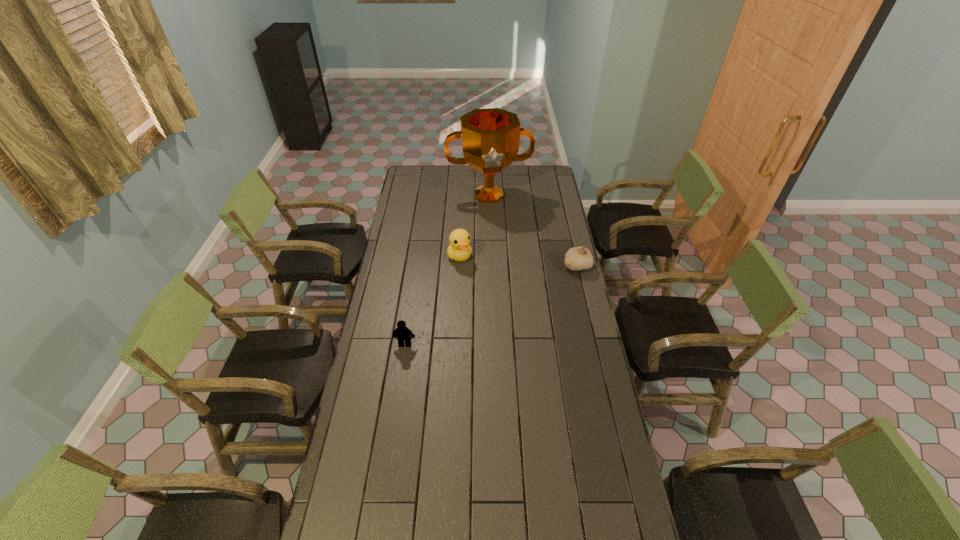
You are a GUI agent. You are given a task and a screenshot of the screen. Output one action in this format:
    pyautogui.click(x=<x>, y=<y>)
    Task: Click on the free spot on the desktop that is between the nearest object and the garlic and is positioned on the side of the farthest object with the star emblem
    
    Given the screenshot: What is the action you would take?
    click(511, 296)

Where is `vacant space on the desktop that is between the nearest object and the garlic and is positioned on the face of the third shortest object`? This screenshot has height=540, width=960. vacant space on the desktop that is between the nearest object and the garlic and is positioned on the face of the third shortest object is located at coordinates (492, 304).